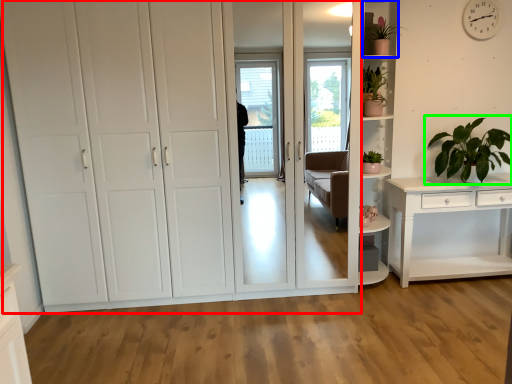
Question: Which object is positioned closest to cupboard (highlighted by a red box)? Select from shelf (highlighted by a blue box) and houseplant (highlighted by a green box).

Choices:
 (A) shelf
 (B) houseplant

Answer: (A)